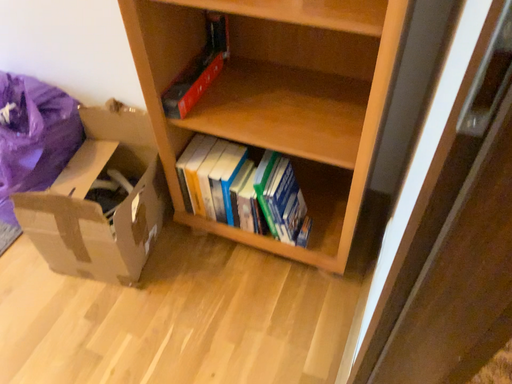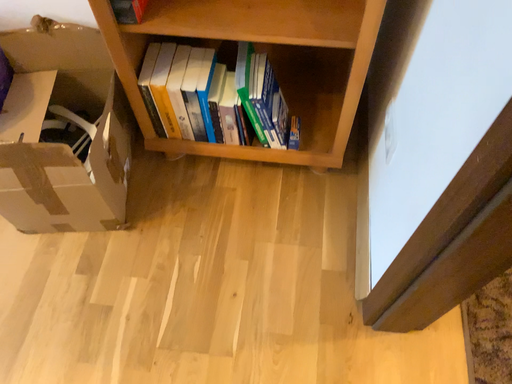
Question: Which way did the camera rotate in the video?

Choices:
 (A) rotated downward
 (B) rotated upward

Answer: (A)